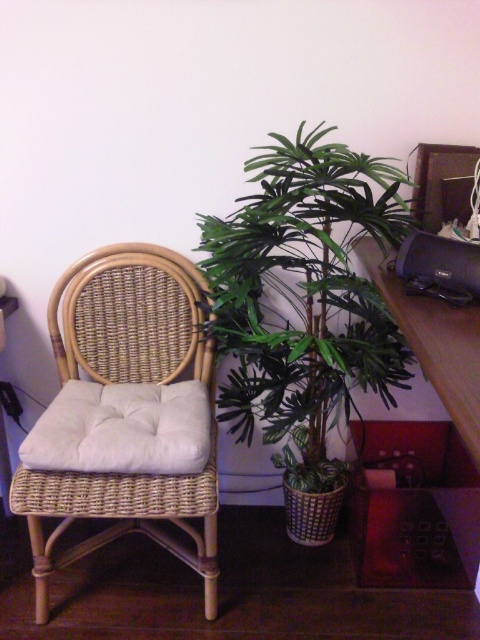
Which is in front, point (257, 369) or point (104, 483)?

Point (104, 483)

In the scene shown: Does green leafy plant at center come in front of woven rattan swivel chair at left?

Yes, it is in front of woven rattan swivel chair at left.

This screenshot has width=480, height=640. I want to click on green leafy plant at center, so click(304, 298).

You are a GUI agent. You are given a task and a screenshot of the screen. Output one action in this format:
    pyautogui.click(x=<x>, y=<y>)
    Task: Click on the green leafy plant at center
    
    Given the screenshot: What is the action you would take?
    [304, 298]